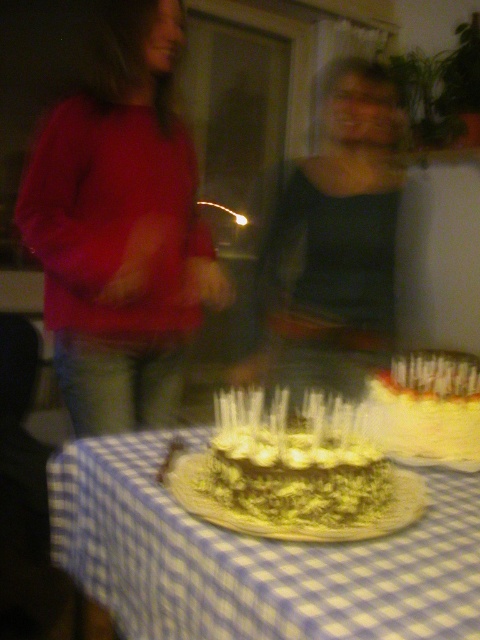
Question: Does blue checkered tablecloth at center appear over dark gray sweater at center?

Choices:
 (A) yes
 (B) no

Answer: (B)

Question: Observing the image, what is the correct spatial positioning of blue checkered tablecloth at center in reference to dark gray sweater at center?

Choices:
 (A) below
 (B) above

Answer: (A)

Question: Which object is farther from the camera taking this photo?

Choices:
 (A) dark gray sweater at center
 (B) white frosted cake at center
 (C) blue checkered tablecloth at center
 (D) matte red sweater at left

Answer: (A)

Question: Which point is closer to the camera taking this photo?

Choices:
 (A) (119, 29)
 (B) (359, 298)
 (C) (465, 483)

Answer: (C)

Question: Which point is closer to the camera?

Choices:
 (A) (107, 502)
 (B) (375, 282)

Answer: (A)

Question: Does dark gray sweater at center have a lesser width compared to chocolate frosted cake at center?

Choices:
 (A) yes
 (B) no

Answer: (B)